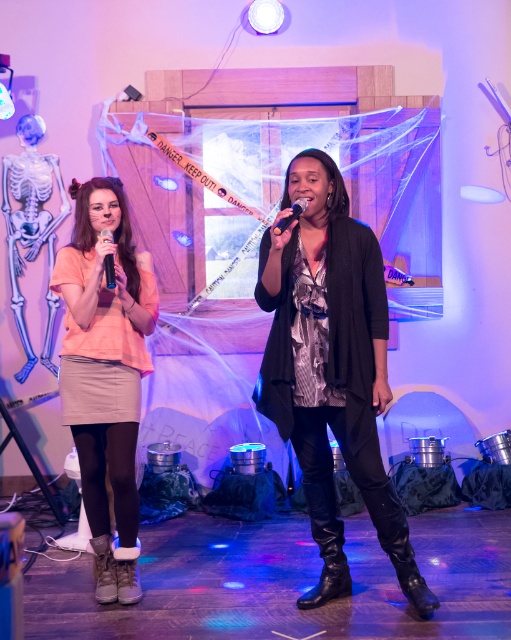
Question: From the image, what is the correct spatial relationship of leather brown boot at lower left in relation to matte black microphone at center?

Choices:
 (A) below
 (B) above

Answer: (A)

Question: Does matte black boots at center have a greater width compared to leather brown boot at lower left?

Choices:
 (A) no
 (B) yes

Answer: (B)

Question: Estimate the real-world distances between objects in this image. Which object is farther from the black leather boot at lower center?

Choices:
 (A) matte black microphone at center
 (B) matte black boots at center

Answer: (A)

Question: Considering the real-world distances, which object is closest to the black leather boot at lower center?

Choices:
 (A) matte black microphone at center
 (B) matte peach shirt at left

Answer: (B)

Question: Which point is closer to the camera?

Choices:
 (A) (336, 580)
 (B) (365, 392)
 (C) (101, 180)

Answer: (B)

Question: Is black leather boot at lower center wider than shiny black microphone at center?

Choices:
 (A) no
 (B) yes

Answer: (B)